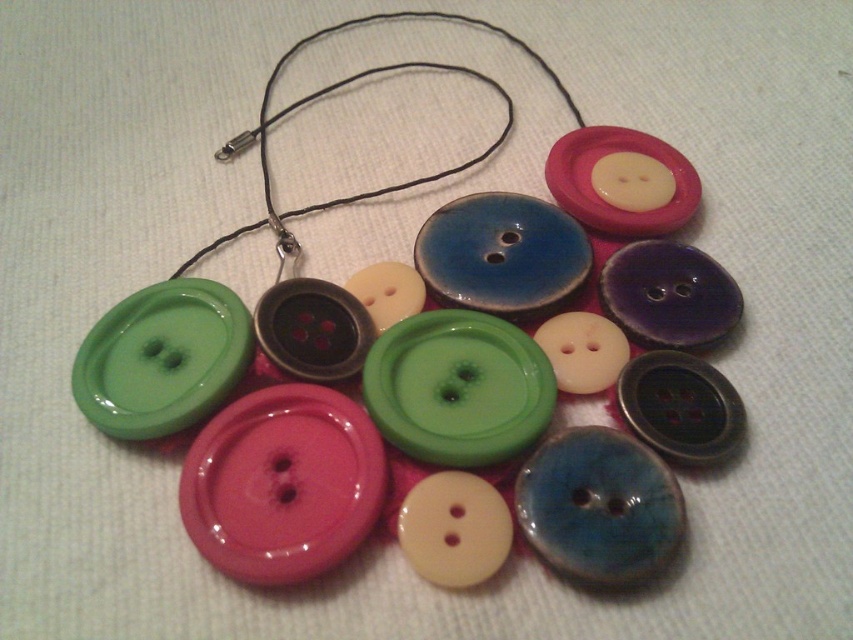
Question: Is glossy plastic buttons at center above black cord at upper center?

Choices:
 (A) yes
 (B) no

Answer: (B)

Question: Is glossy plastic buttons at center to the right of black cord at upper center from the viewer's perspective?

Choices:
 (A) yes
 (B) no

Answer: (A)

Question: Which of the following is the closest to the observer?

Choices:
 (A) (480, 80)
 (B) (190, 349)

Answer: (B)

Question: Does glossy plastic buttons at center have a larger size compared to black cord at upper center?

Choices:
 (A) yes
 (B) no

Answer: (A)

Question: Which point is closer to the camera?

Choices:
 (A) glossy plastic buttons at center
 (B) black cord at upper center

Answer: (A)